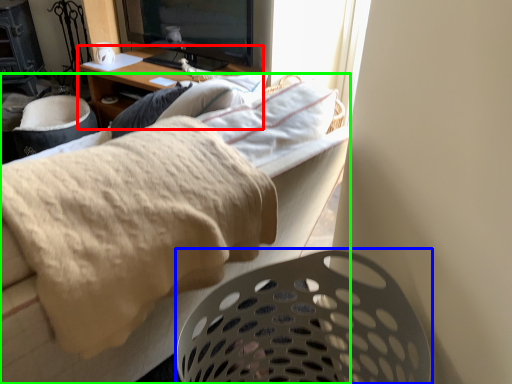
Question: Which object is positioned closest to desk (highlighted by a red box)? Select from laundry basket (highlighted by a blue box) and furniture (highlighted by a green box).

Choices:
 (A) laundry basket
 (B) furniture

Answer: (B)